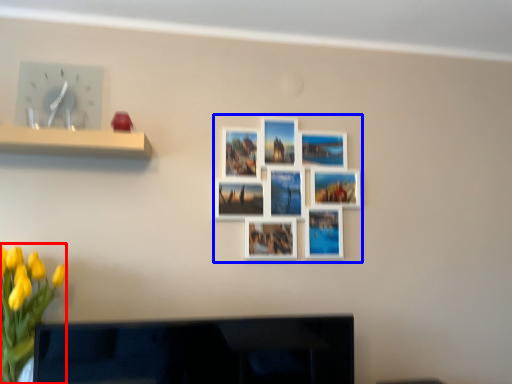
Question: Which of the following is the closest to the observer, floral arrangement (highlighted by a red box) or decorative picture (highlighted by a blue box)?

Choices:
 (A) floral arrangement
 (B) decorative picture

Answer: (A)